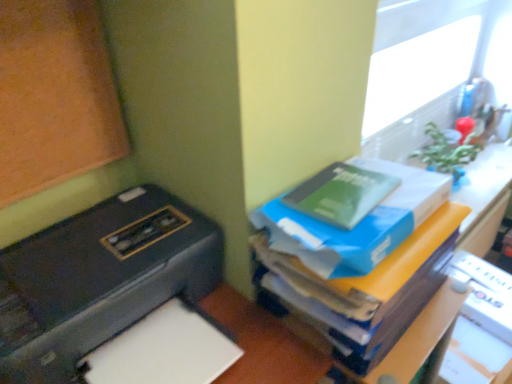
Question: From a real-world perspective, is green matte book at upper right, the second paperback book positioned from the top, under green matte book at upper right, placed as the 1th paperback book when sorted from top to bottom?

Choices:
 (A) yes
 (B) no

Answer: (A)

Question: Is green matte book at upper right, the second paperback book positioned from the top, positioned with its back to green matte book at upper right, acting as the second paperback book starting from the bottom?

Choices:
 (A) no
 (B) yes

Answer: (B)

Question: Is there a large distance between green matte book at upper right, the first paperback book ordered from the bottom, and green matte book at upper right, placed as the 1th paperback book when sorted from top to bottom?

Choices:
 (A) yes
 (B) no

Answer: (B)

Question: Does green matte book at upper right, the first paperback book ordered from the bottom, appear on the right side of green matte book at upper right, acting as the second paperback book starting from the bottom?

Choices:
 (A) no
 (B) yes

Answer: (B)

Question: Is green matte book at upper right, the first paperback book ordered from the bottom, completely or partially outside of green matte book at upper right, placed as the 1th paperback book when sorted from top to bottom?

Choices:
 (A) yes
 (B) no

Answer: (A)

Question: From the image's perspective, is green matte book at upper right, the second paperback book positioned from the top, on top of green matte book at upper right, placed as the 1th paperback book when sorted from top to bottom?

Choices:
 (A) no
 (B) yes

Answer: (A)

Question: From the image's perspective, is green matte book at upper right, the second paperback book positioned from the top, on blue cardboard box at upper right?

Choices:
 (A) yes
 (B) no

Answer: (A)

Question: Is green matte book at upper right, the first paperback book ordered from the bottom, located outside blue cardboard box at upper right?

Choices:
 (A) yes
 (B) no

Answer: (A)

Question: Can you confirm if green matte book at upper right, the first paperback book ordered from the bottom, is smaller than blue cardboard box at upper right?

Choices:
 (A) yes
 (B) no

Answer: (A)

Question: Would you consider green matte book at upper right, the first paperback book ordered from the bottom, to be distant from blue cardboard box at upper right?

Choices:
 (A) no
 (B) yes

Answer: (A)

Question: From the image's perspective, is green matte book at upper right, the first paperback book ordered from the bottom, below blue cardboard box at upper right?

Choices:
 (A) no
 (B) yes

Answer: (A)

Question: Is green matte book at upper right, the first paperback book ordered from the bottom, closer to the viewer compared to blue cardboard box at upper right?

Choices:
 (A) yes
 (B) no

Answer: (B)

Question: Could you tell me if white paper at lower left is facing blue cardboard box at upper right?

Choices:
 (A) yes
 (B) no

Answer: (B)